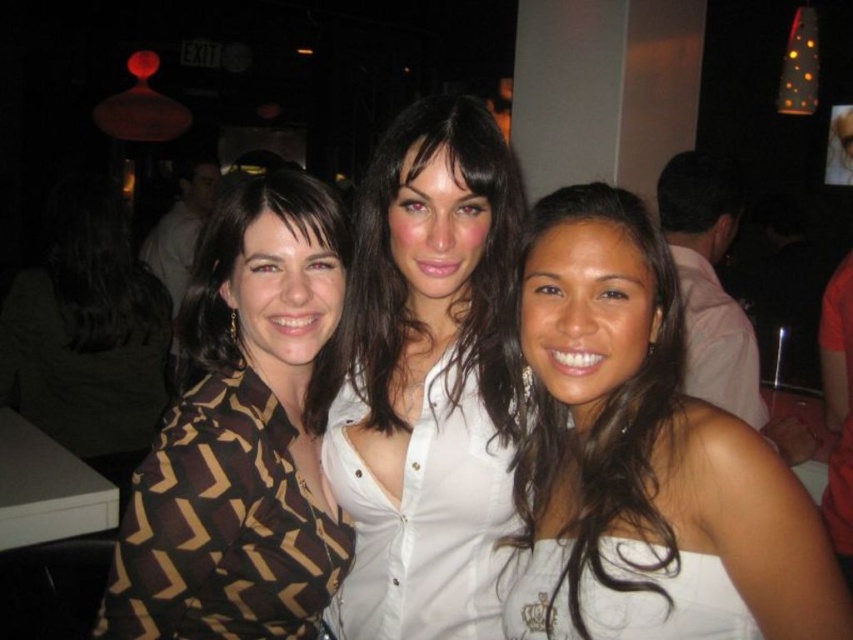
Question: Observing the image, what is the correct spatial positioning of white satin blouse at center in reference to brown chevron-patterned blouse at center?

Choices:
 (A) right
 (B) left

Answer: (A)

Question: Based on their relative distances, which object is nearer to the white satin dress at center?

Choices:
 (A) brown chevron-patterned blouse at center
 (B) pink fabric at upper right

Answer: (A)

Question: Estimate the real-world distances between objects in this image. Which object is closer to the brown chevron-patterned blouse at center?

Choices:
 (A) white satin blouse at center
 (B) pink fabric at upper right

Answer: (A)

Question: Is white satin dress at center above pink fabric at upper right?

Choices:
 (A) yes
 (B) no

Answer: (B)

Question: Based on their relative distances, which object is farther from the pink fabric at upper right?

Choices:
 (A) brown chevron-patterned blouse at center
 (B) white satin dress at center
 (C) white satin blouse at center

Answer: (A)

Question: Does white satin dress at center come in front of white satin blouse at center?

Choices:
 (A) no
 (B) yes

Answer: (B)